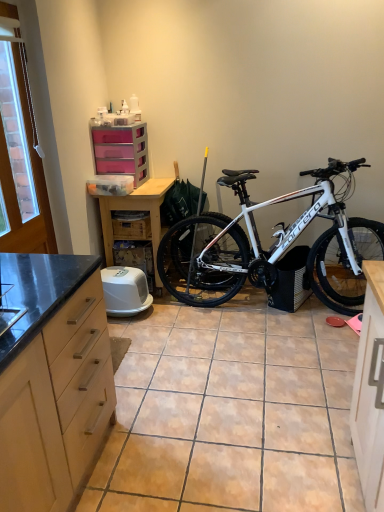
Question: Can you confirm if pink plastic chest of drawers at upper center is smaller than matte wood cabinet at left?

Choices:
 (A) yes
 (B) no

Answer: (A)

Question: Is pink plastic chest of drawers at upper center touching matte wood cabinet at left?

Choices:
 (A) no
 (B) yes

Answer: (A)

Question: Can you confirm if pink plastic chest of drawers at upper center is thinner than matte wood cabinet at left?

Choices:
 (A) yes
 (B) no

Answer: (A)

Question: Is pink plastic chest of drawers at upper center located outside matte wood cabinet at left?

Choices:
 (A) no
 (B) yes

Answer: (B)

Question: Is pink plastic chest of drawers at upper center facing towards matte wood cabinet at left?

Choices:
 (A) no
 (B) yes

Answer: (B)

Question: Considering the relative sizes of pink plastic chest of drawers at upper center and matte wood cabinet at left in the image provided, is pink plastic chest of drawers at upper center bigger than matte wood cabinet at left?

Choices:
 (A) no
 (B) yes

Answer: (A)

Question: Does matte wood cabinet at left have a greater width compared to brown tile at center?

Choices:
 (A) no
 (B) yes

Answer: (A)

Question: Does matte wood cabinet at left have a lesser height compared to brown tile at center?

Choices:
 (A) yes
 (B) no

Answer: (B)

Question: Is matte wood cabinet at left next to brown tile at center?

Choices:
 (A) yes
 (B) no

Answer: (B)

Question: Can you confirm if matte wood cabinet at left is thinner than brown tile at center?

Choices:
 (A) no
 (B) yes

Answer: (B)

Question: Is matte wood cabinet at left to the left of brown tile at center from the viewer's perspective?

Choices:
 (A) no
 (B) yes

Answer: (B)

Question: Would you say matte wood cabinet at left is a long distance from brown tile at center?

Choices:
 (A) no
 (B) yes

Answer: (A)

Question: Is wooden crate at center a part of white plastic chain at upper left?

Choices:
 (A) yes
 (B) no

Answer: (B)